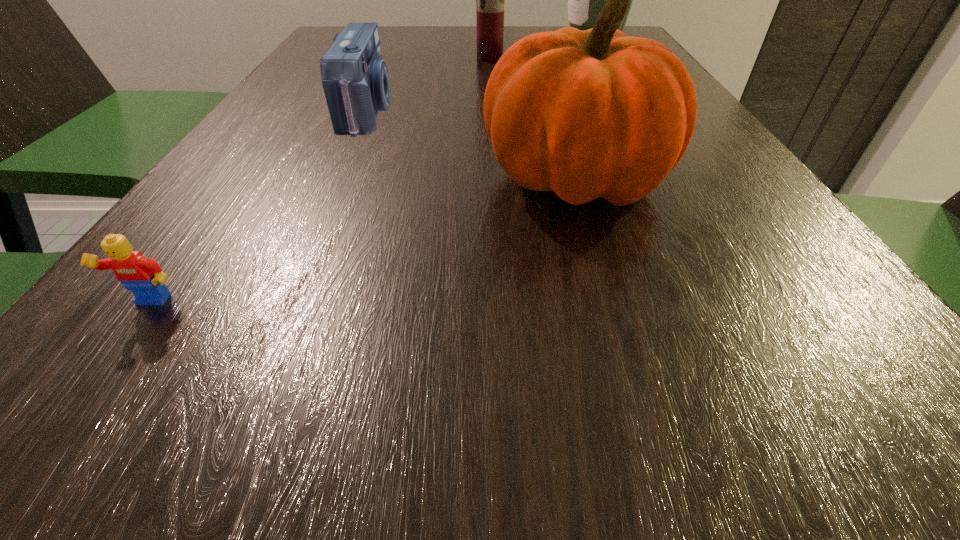
Locate an element on the screen. Image resolution: width=960 pixels, height=540 pixels. free region that satisfies the following two spatial constraints: 1. on the label of the nearer liquor; 2. on the left side of the pumpkin is located at coordinates (495, 178).

This screenshot has height=540, width=960. In order to click on free space that satisfies the following two spatial constraints: 1. on the front-facing side of the farthest object; 2. on the label of the fourth nearest object in this screenshot , I will do `click(603, 58)`.

At what (x,y) coordinates should I click in order to perform the action: click on free space that satisfies the following two spatial constraints: 1. on the front-facing side of the right liquor; 2. on the label of the fourth nearest object. Please return your answer as a coordinate pair (x, y). Looking at the image, I should click on (603, 58).